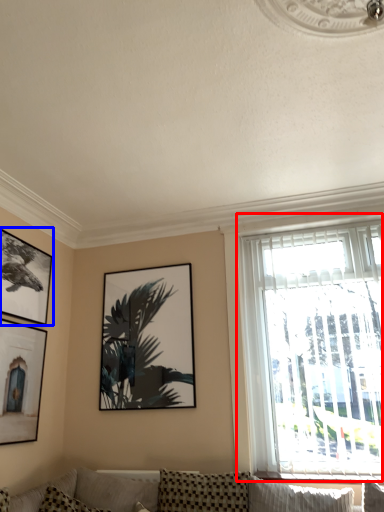
Question: Which point is closer to the camera, window (highlighted by a red box) or picture frame (highlighted by a blue box)?

Choices:
 (A) window
 (B) picture frame

Answer: (A)